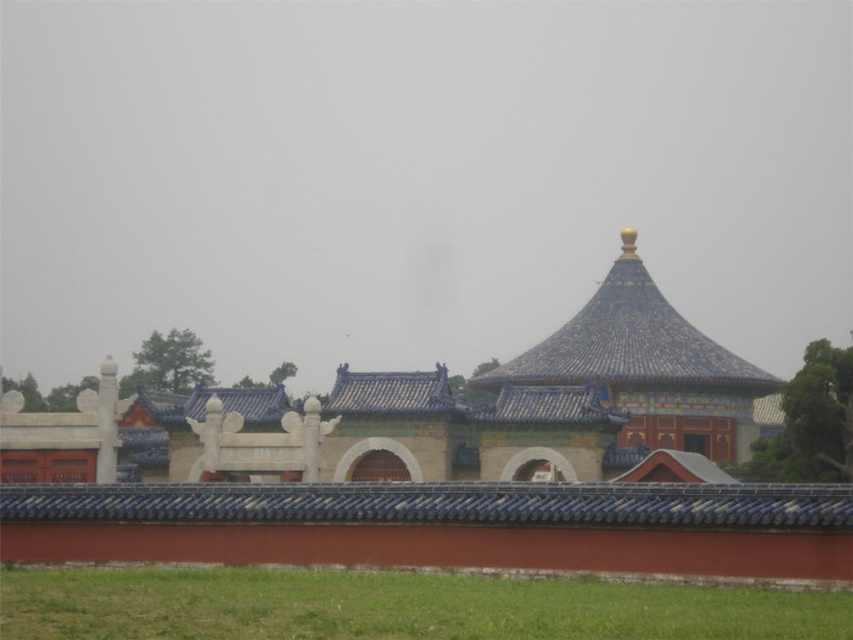
You are standing in front of the temple complex and notice two sets of blue glazed tiles. The first set is labeled as blue glazed tiles at center, and the second is blue glazed tile roof at center. Which of these two sets is positioned closer to you?

The blue glazed tiles at center are closer to the viewer than the blue glazed tile roof at center.

You are an architect visiting this temple complex and notice two blue glazed structures. The first is labeled as blue glazed tiles at center and the second as blue glazed tile roof at center. Which of these two structures is larger in size?

The blue glazed tiles at center is smaller than blue glazed tile roof at center, so the blue glazed tile roof at center is larger in size.